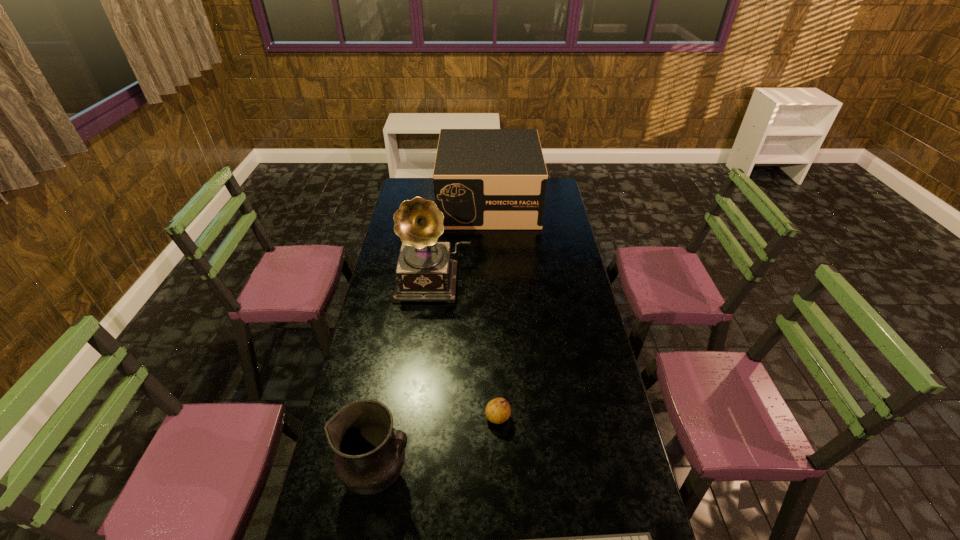
Locate an element on the screen. record player is located at coordinates (425, 272).

Identify the location of the second farthest object. (425, 272).

Locate an element on the screen. The height and width of the screenshot is (540, 960). the farthest object is located at coordinates (484, 179).

Locate an element on the screen. The width and height of the screenshot is (960, 540). the fourth farthest object is located at coordinates (369, 455).

Locate an element on the screen. This screenshot has width=960, height=540. pitcher is located at coordinates (369, 455).

The image size is (960, 540). Find the location of `pear`. pear is located at coordinates (497, 411).

At what (x,y) coordinates should I click in order to perform the action: click on the fourth tallest object. Please return your answer as a coordinate pair (x, y). Looking at the image, I should click on (497, 411).

Where is `vacant point located on the horn of the tallest object`? This screenshot has width=960, height=540. vacant point located on the horn of the tallest object is located at coordinates (429, 321).

Where is `vacant space positioned on the front-facing side of the box`? This screenshot has width=960, height=540. vacant space positioned on the front-facing side of the box is located at coordinates (491, 261).

The image size is (960, 540). Identify the location of vacant space situated 0.350m on the handle side of the pitcher. (534, 476).